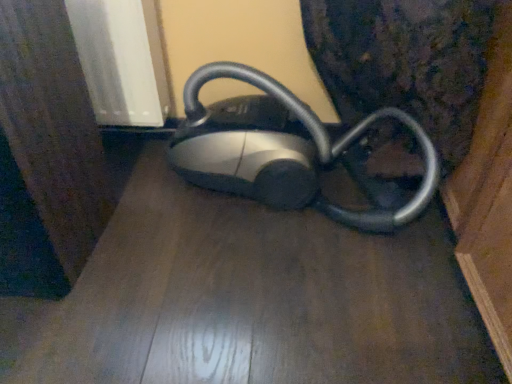
Where is `matte black vacuum cleaner at center`? The height and width of the screenshot is (384, 512). matte black vacuum cleaner at center is located at coordinates (247, 297).

This screenshot has width=512, height=384. What do you see at coordinates (247, 297) in the screenshot?
I see `matte black vacuum cleaner at center` at bounding box center [247, 297].

The image size is (512, 384). What do you see at coordinates (278, 148) in the screenshot?
I see `silver metallic vacuum cleaner at center` at bounding box center [278, 148].

In order to face silver metallic vacuum cleaner at center, should I rotate leftwards or rightwards?

Turn right approximately 4.768 degrees to face it.

Identify the location of silver metallic vacuum cleaner at center. (278, 148).

Locate an element on the screen. matte black vacuum cleaner at center is located at coordinates (247, 297).

Considering the relative positions of silver metallic vacuum cleaner at center and matte black vacuum cleaner at center in the image provided, is silver metallic vacuum cleaner at center to the right of matte black vacuum cleaner at center from the viewer's perspective?

Yes.

Is silver metallic vacuum cleaner at center positioned in front of matte black vacuum cleaner at center?

No.

Which point is more forward, [307,126] or [453,382]?

Positioned in front is point [453,382].

From the image's perspective, which is below, silver metallic vacuum cleaner at center or matte black vacuum cleaner at center?

matte black vacuum cleaner at center.

From a real-world perspective, is silver metallic vacuum cleaner at center located beneath matte black vacuum cleaner at center?

No, from a real-world perspective, silver metallic vacuum cleaner at center is not below matte black vacuum cleaner at center.

In terms of width, does silver metallic vacuum cleaner at center look wider or thinner when compared to matte black vacuum cleaner at center?

silver metallic vacuum cleaner at center is thinner than matte black vacuum cleaner at center.

Which of these two, silver metallic vacuum cleaner at center or matte black vacuum cleaner at center, stands shorter?

matte black vacuum cleaner at center.

In terms of size, does silver metallic vacuum cleaner at center appear bigger or smaller than matte black vacuum cleaner at center?

Clearly, silver metallic vacuum cleaner at center is larger in size than matte black vacuum cleaner at center.

Is matte black vacuum cleaner at center surrounded by silver metallic vacuum cleaner at center?

Definitely not — matte black vacuum cleaner at center is not inside silver metallic vacuum cleaner at center.

Is silver metallic vacuum cleaner at center with matte black vacuum cleaner at center?

No, silver metallic vacuum cleaner at center is not beside matte black vacuum cleaner at center.

Is matte black vacuum cleaner at center at the back of silver metallic vacuum cleaner at center?

No, silver metallic vacuum cleaner at center is not facing the opposite direction of matte black vacuum cleaner at center.

Measure the distance from silver metallic vacuum cleaner at center to matte black vacuum cleaner at center.

silver metallic vacuum cleaner at center is 8.09 inches from matte black vacuum cleaner at center.

The height and width of the screenshot is (384, 512). I want to click on home appliance behind the matte black vacuum cleaner at center, so click(x=278, y=148).

Considering the relative positions of matte black vacuum cleaner at center and silver metallic vacuum cleaner at center in the image provided, is matte black vacuum cleaner at center to the right of silver metallic vacuum cleaner at center from the viewer's perspective?

Incorrect, matte black vacuum cleaner at center is not on the right side of silver metallic vacuum cleaner at center.

Is the position of matte black vacuum cleaner at center less distant than that of silver metallic vacuum cleaner at center?

Yes, it is.

Which point is more distant from viewer, (78, 335) or (296, 167)?

The point (296, 167) is farther.

Based on the photo, from the image's perspective, relative to silver metallic vacuum cleaner at center, is matte black vacuum cleaner at center above or below?

matte black vacuum cleaner at center is situated lower than silver metallic vacuum cleaner at center in the image.

Based on the photo, from a real-world perspective, between matte black vacuum cleaner at center and silver metallic vacuum cleaner at center, who is vertically higher?

silver metallic vacuum cleaner at center.

Which of these two, matte black vacuum cleaner at center or silver metallic vacuum cleaner at center, is wider?

matte black vacuum cleaner at center.

Is matte black vacuum cleaner at center shorter than silver metallic vacuum cleaner at center?

Yes, matte black vacuum cleaner at center is shorter than silver metallic vacuum cleaner at center.

Based on their sizes in the image, would you say matte black vacuum cleaner at center is bigger or smaller than silver metallic vacuum cleaner at center?

matte black vacuum cleaner at center is smaller than silver metallic vacuum cleaner at center.

Is matte black vacuum cleaner at center surrounding silver metallic vacuum cleaner at center?

No, silver metallic vacuum cleaner at center is located outside of matte black vacuum cleaner at center.

Are matte black vacuum cleaner at center and silver metallic vacuum cleaner at center far apart?

matte black vacuum cleaner at center is actually quite close to silver metallic vacuum cleaner at center.

Does matte black vacuum cleaner at center turn towards silver metallic vacuum cleaner at center?

No, matte black vacuum cleaner at center is not facing towards silver metallic vacuum cleaner at center.

Can you tell me how much matte black vacuum cleaner at center and silver metallic vacuum cleaner at center differ in facing direction?

There is a 92.9-degree angle between the facing directions of matte black vacuum cleaner at center and silver metallic vacuum cleaner at center.

The width and height of the screenshot is (512, 384). In order to click on surface below the silver metallic vacuum cleaner at center (from the image's perspective) in this screenshot , I will do `click(247, 297)`.

In order to click on home appliance located above the matte black vacuum cleaner at center (from the image's perspective) in this screenshot , I will do `click(278, 148)`.

The width and height of the screenshot is (512, 384). Identify the location of surface in front of the silver metallic vacuum cleaner at center. (247, 297).